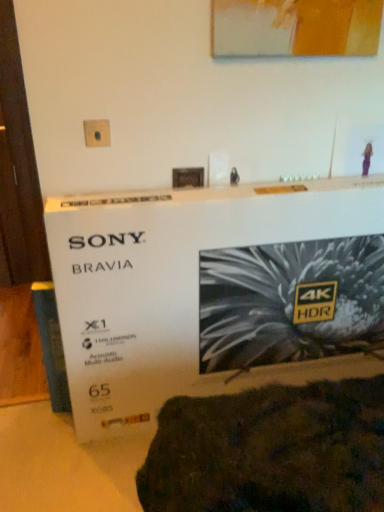
Question: Considering the positions of point (182, 303) and point (266, 4), is point (182, 303) closer or farther from the camera than point (266, 4)?

Choices:
 (A) closer
 (B) farther

Answer: (B)

Question: In terms of width, does white cardboard box at center look wider or thinner when compared to matte acrylic picture frame at upper center?

Choices:
 (A) thin
 (B) wide

Answer: (B)

Question: Which object is the farthest from the matte plastic outlet at upper center?

Choices:
 (A) white cardboard box at center
 (B) matte acrylic picture frame at upper center

Answer: (A)

Question: Estimate the real-world distances between objects in this image. Which object is farther from the matte acrylic picture frame at upper center?

Choices:
 (A) matte plastic outlet at upper center
 (B) white cardboard box at center

Answer: (B)